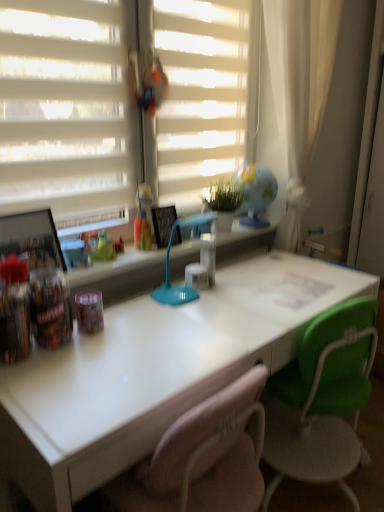
You are a GUI agent. You are given a task and a screenshot of the screen. Output one action in this format:
    pyautogui.click(x=<x>, y=<y>)
    Task: Click on the free spot in front of blue plastic table lamp at center
    This screenshot has width=384, height=512.
    Given the screenshot: What is the action you would take?
    pyautogui.click(x=186, y=332)